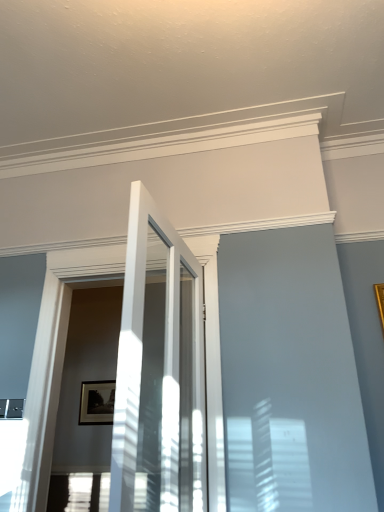
Question: From a real-world perspective, is matte black picture frame at center positioned above or below white glossy door at center?

Choices:
 (A) above
 (B) below

Answer: (A)

Question: Based on their positions, is matte black picture frame at center located to the left or right of white glossy door at center?

Choices:
 (A) right
 (B) left

Answer: (B)

Question: Considering the positions of point (105, 413) and point (142, 214), is point (105, 413) closer or farther from the camera than point (142, 214)?

Choices:
 (A) closer
 (B) farther

Answer: (B)

Question: In the image, is white glossy door at center positioned in front of or behind matte black picture frame at center?

Choices:
 (A) front
 (B) behind

Answer: (A)

Question: Is point (183, 283) closer or farther from the camera than point (86, 414)?

Choices:
 (A) farther
 (B) closer

Answer: (B)

Question: From a real-world perspective, is white glossy door at center positioned above or below matte black picture frame at center?

Choices:
 (A) below
 (B) above

Answer: (A)

Question: From the image's perspective, is white glossy door at center above or below matte black picture frame at center?

Choices:
 (A) above
 (B) below

Answer: (A)